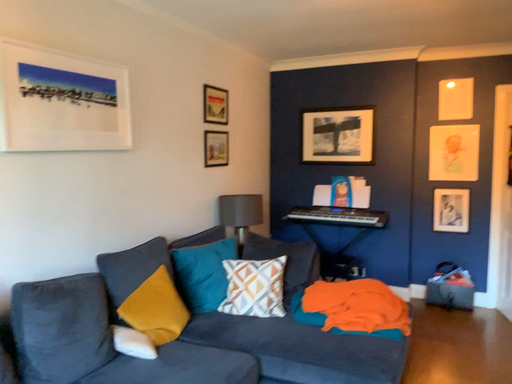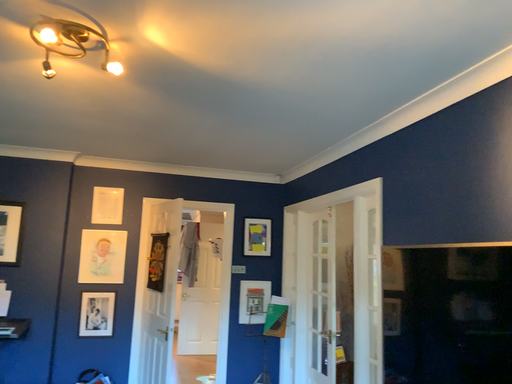
Question: How did the camera likely rotate when shooting the video?

Choices:
 (A) rotated left
 (B) rotated right

Answer: (B)